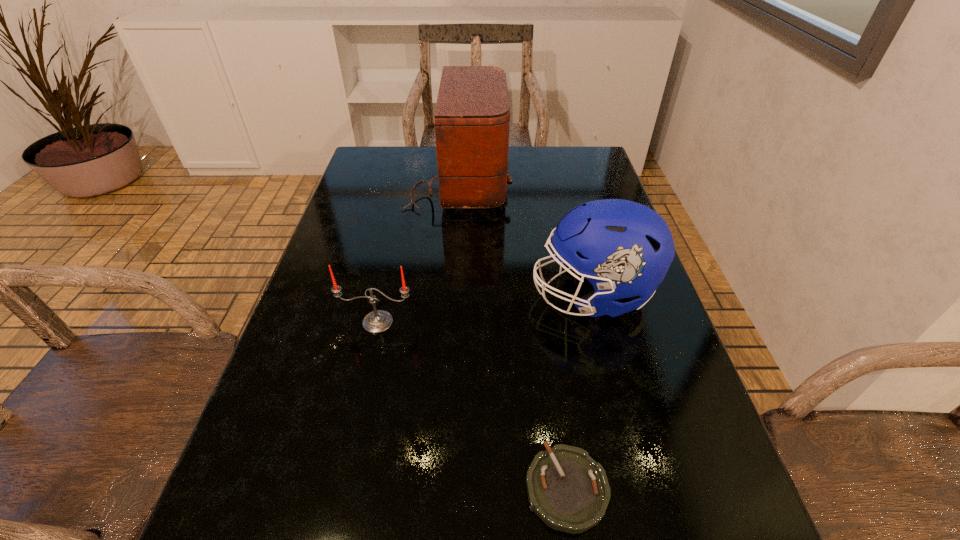
Where is `vacant region located 0.290m on the front-facing side of the candle`? vacant region located 0.290m on the front-facing side of the candle is located at coordinates (342, 483).

I want to click on vacant space located 0.100m on the back of the nearest object, so coord(553,393).

Identify the location of object present at the far edge. This screenshot has height=540, width=960. [x=472, y=116].

Locate an element on the screen. The width and height of the screenshot is (960, 540). radio receiver at the left edge is located at coordinates (472, 116).

Locate an element on the screen. candle located in the left edge section of the desktop is located at coordinates (378, 321).

Where is `object located in the right edge section of the desktop`? The height and width of the screenshot is (540, 960). object located in the right edge section of the desktop is located at coordinates (624, 249).

Identify the location of object located in the far left corner section of the desktop. (472, 116).

Locate an element on the screen. The height and width of the screenshot is (540, 960). free spot at the far edge of the desktop is located at coordinates (537, 159).

The height and width of the screenshot is (540, 960). What are the coordinates of `vacant point at the left edge` in the screenshot? It's located at (336, 376).

This screenshot has width=960, height=540. I want to click on free space at the right edge of the desktop, so click(638, 332).